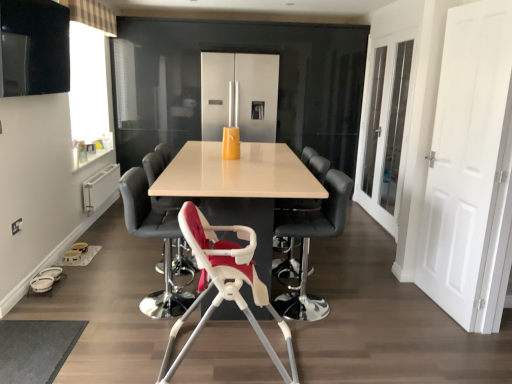
Locate an element on the screen. This screenshot has width=512, height=384. blank space to the left of white plastic highchair at center, arranged as the fourth chair when viewed from the back is located at coordinates (106, 302).